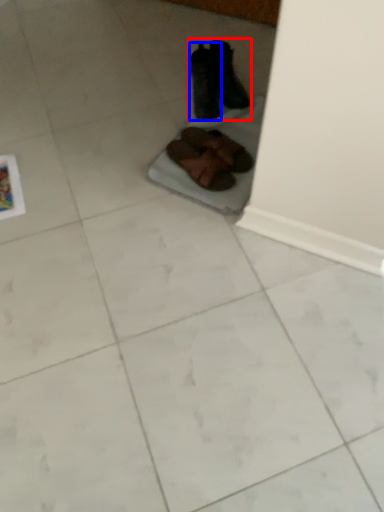
Question: Which object is further to the camera taking this photo, footwear (highlighted by a red box) or footwear (highlighted by a blue box)?

Choices:
 (A) footwear
 (B) footwear

Answer: (A)